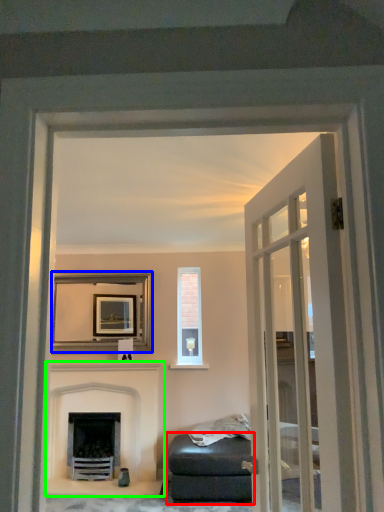
Question: Which is farther away from studio couch (highlighted by a red box)? picture frame (highlighted by a blue box) or fireplace (highlighted by a green box)?

Choices:
 (A) picture frame
 (B) fireplace

Answer: (A)